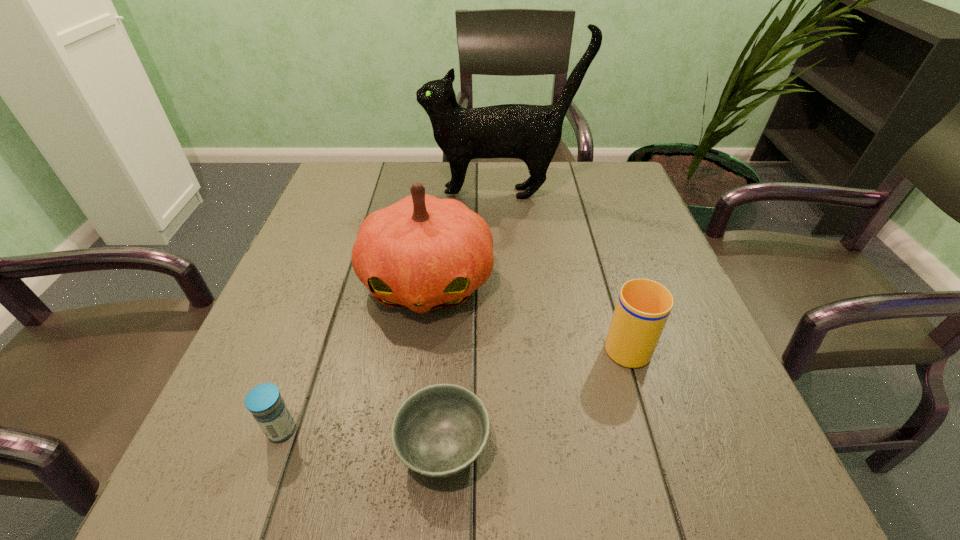
You are a GUI agent. You are given a task and a screenshot of the screen. Output one action in this format:
    pyautogui.click(x=<x>, y=<y>)
    Task: Click on the vacant region located 0.050m on the front-facing side of the pumpkin
    This screenshot has height=540, width=960.
    Given the screenshot: What is the action you would take?
    pyautogui.click(x=419, y=352)

Find the location of `free space located on the side of the third tallest object with the handle`. free space located on the side of the third tallest object with the handle is located at coordinates (588, 218).

Where is `vacant space located on the side of the third tallest object with the handle`? Image resolution: width=960 pixels, height=540 pixels. vacant space located on the side of the third tallest object with the handle is located at coordinates (592, 235).

Identify the location of vacant space located 0.180m on the side of the third tallest object with the handle. Image resolution: width=960 pixels, height=540 pixels. (599, 257).

Where is `vacant space situated on the back of the second shortest object`? This screenshot has height=540, width=960. vacant space situated on the back of the second shortest object is located at coordinates (300, 379).

This screenshot has width=960, height=540. Identify the location of vacant space located 0.340m on the back of the bowl. (455, 265).

Locate an element on the screen. The height and width of the screenshot is (540, 960). object situated at the far edge is located at coordinates (532, 133).

Locate an element on the screen. Image resolution: width=960 pixels, height=540 pixels. object that is at the near edge is located at coordinates coord(440,430).

Where is `object that is at the left edge`? This screenshot has width=960, height=540. object that is at the left edge is located at coordinates (264, 401).

This screenshot has width=960, height=540. In order to click on cat positioned at the right edge in this screenshot , I will do `click(532, 133)`.